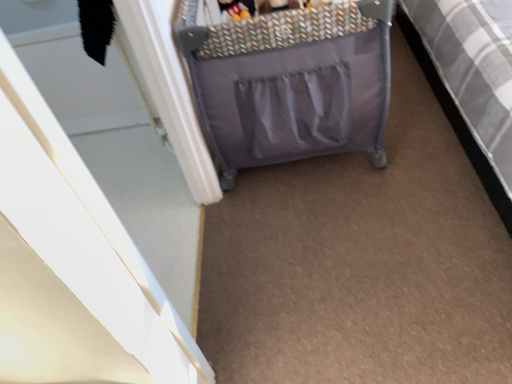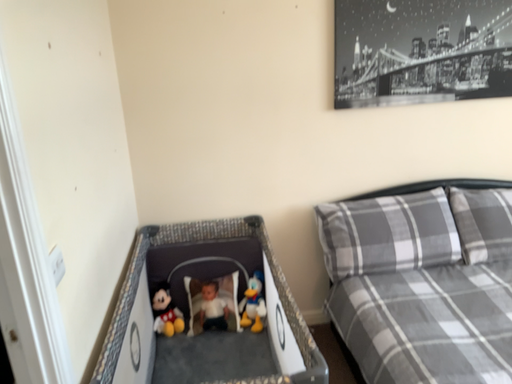
Question: Which way did the camera rotate in the video?

Choices:
 (A) rotated downward
 (B) rotated upward

Answer: (B)